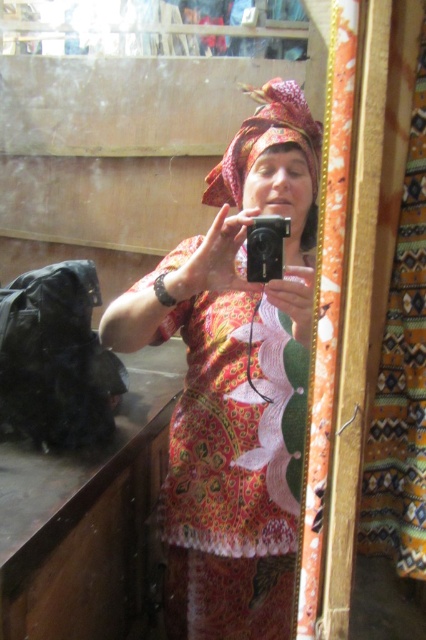
You are standing in the room and want to adjust the lighting to better highlight the printed fabric dress at center. Based on the scene description, where should you position the light source relative to the dress?

The printed fabric dress at center is located at point (236, 381), so you should position the light source to the left of the dress to avoid harsh shadows and ensure even lighting across its vibrant patterns.

You are a fashion designer observing a model wearing a printed fabric dress at center and a printed fabric shawl at center. Which clothing item is more to the left?

The printed fabric dress at center is positioned on the left side of the printed fabric shawl at center, so the dress is more to the left.